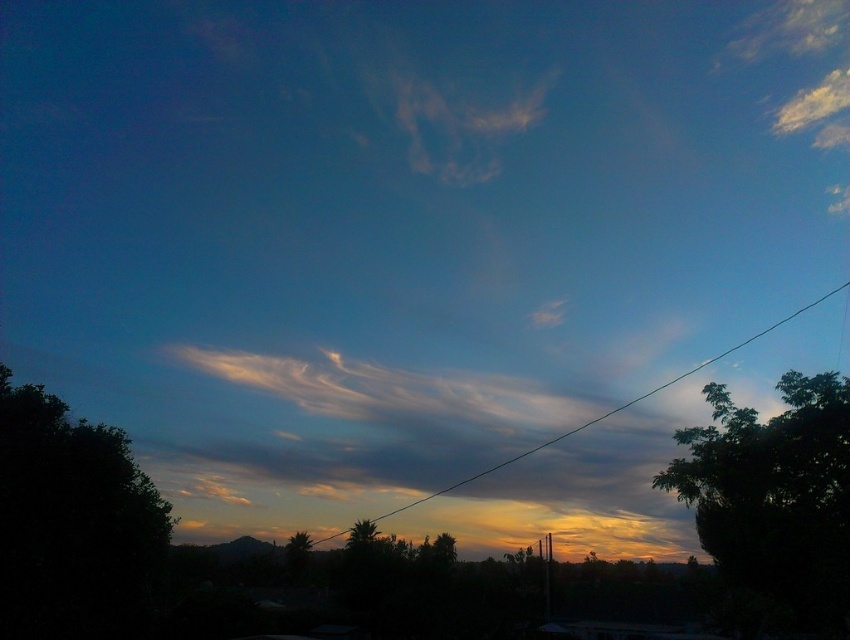
You are standing at the center of the image and want to locate the dark green leafy tree at left. Which direction should you look to find it?

The dark green leafy tree at left is located at point 0.820 on the x axis and 0.086 on the y axis, so you should look to the left and slightly downward from the center to find it.

You are standing in the center of the scene and want to walk towards the green leafy tree at right. In which direction should you head?

You should head to the right because the green leafy tree at right is located at the right side of the scene.